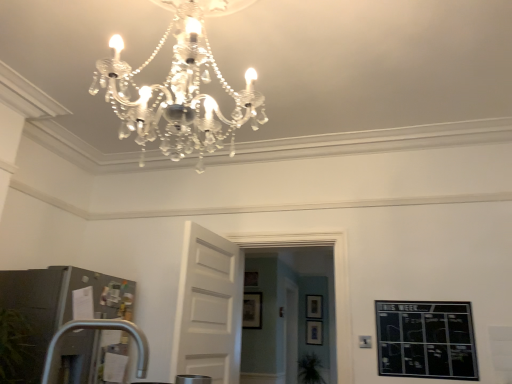
This screenshot has height=384, width=512. Identify the location of wooden picture frame at center, the 1th picture frame viewed from the back. coord(314,306).

This screenshot has height=384, width=512. In order to click on wooden picture frame at center, acting as the first picture frame starting from the left in this screenshot , I will do click(x=251, y=278).

Is wooden picture frame at center, which appears as the third picture frame when viewed from the top, facing away from transparent glass door at center?

No, wooden picture frame at center, which appears as the third picture frame when viewed from the top, is not facing the opposite direction of transparent glass door at center.

Is wooden picture frame at center, which is the fourth picture frame from front to back, spatially inside transparent glass door at center, or outside of it?

wooden picture frame at center, which is the fourth picture frame from front to back, lies outside transparent glass door at center.

Which is more to the left, wooden picture frame at center, placed as the first picture frame when sorted from right to left, or transparent glass door at center?

Positioned to the left is transparent glass door at center.

From a real-world perspective, which is physically below, matte black picture frame at center, the second picture frame from the right, or matte black picture frame at center, which is counted as the 1th picture frame, starting from the front?

matte black picture frame at center, the second picture frame from the right, from a real-world perspective.

Is matte black picture frame at center, the 3th picture frame when ordered from left to right, far from matte black picture frame at center, the second picture frame in the left-to-right sequence?

Yes.

In the scene shown: Which is correct: matte black picture frame at center, placed as the fourth picture frame when sorted from top to bottom, is inside matte black picture frame at center, which is counted as the 1th picture frame, starting from the front, or outside of it?

matte black picture frame at center, placed as the fourth picture frame when sorted from top to bottom, is spatially situated outside matte black picture frame at center, which is counted as the 1th picture frame, starting from the front.

Would you say white wooden door at center is a long distance from wooden picture frame at center, the 1th picture frame viewed from the back?

Yes.

Which of these two, white wooden door at center or wooden picture frame at center, which appears as the third picture frame when viewed from the top, is wider?

Wider between the two is white wooden door at center.

Is white wooden door at center positioned with its back to wooden picture frame at center, the 4th picture frame viewed from the left?

No.

Is transparent glass door at center aimed at wooden picture frame at center, the 1th picture frame viewed from the back?

No, transparent glass door at center is not aimed at wooden picture frame at center, the 1th picture frame viewed from the back.

Can you confirm if transparent glass door at center is bigger than wooden picture frame at center, the 4th picture frame viewed from the left?

Yes, transparent glass door at center is bigger than wooden picture frame at center, the 4th picture frame viewed from the left.

Considering the sizes of objects transparent glass door at center and wooden picture frame at center, positioned as the second picture frame in bottom-to-top order, in the image provided, who is taller, transparent glass door at center or wooden picture frame at center, positioned as the second picture frame in bottom-to-top order,?

transparent glass door at center.

How many degrees apart are the facing directions of matte black picture frame at center, placed as the fourth picture frame when sorted from top to bottom, and green leafy plant at lower center?

They differ by 0.778 degrees in their facing directions.

Can we say matte black picture frame at center, marked as the third picture frame in a front-to-back arrangement, lies outside green leafy plant at lower center?

Yes, matte black picture frame at center, marked as the third picture frame in a front-to-back arrangement, is outside of green leafy plant at lower center.

At what (x,y) coordinates should I click in order to perform the action: click on plant in front of the matte black picture frame at center, the second picture frame from the right. Please return your answer as a coordinate pair (x, y). Looking at the image, I should click on (310, 369).

In the scene shown: Is matte black picture frame at center, the 3th picture frame when ordered from left to right, positioned with its back to green leafy plant at lower center?

No, green leafy plant at lower center is not at the back of matte black picture frame at center, the 3th picture frame when ordered from left to right.

Is white wooden door at center at the right side of matte black picture frame at center, the second picture frame from the right?

No, white wooden door at center is not to the right of matte black picture frame at center, the second picture frame from the right.

Which is in front, white wooden door at center or matte black picture frame at center, the 3th picture frame when ordered from left to right?

white wooden door at center.

Is white wooden door at center oriented towards matte black picture frame at center, the 2th picture frame in the back-to-front sequence?

No.

Is white wooden door at center not inside matte black picture frame at center, the second picture frame from the right?

Absolutely, white wooden door at center is external to matte black picture frame at center, the second picture frame from the right.

Can you confirm if matte black picture frame at center, which ranks as the third picture frame in right-to-left order, is positioned to the right of green leafy plant at lower center?

No.

From the picture: Can you tell me how much matte black picture frame at center, arranged as the 2th picture frame when viewed from the top, and green leafy plant at lower center differ in facing direction?

The facing directions of matte black picture frame at center, arranged as the 2th picture frame when viewed from the top, and green leafy plant at lower center are 0.852 degrees apart.

Between matte black picture frame at center, the second picture frame in the left-to-right sequence, and green leafy plant at lower center, which one is positioned behind?

green leafy plant at lower center is more distant.

Would you say matte black picture frame at center, the second picture frame in the left-to-right sequence, is inside or outside green leafy plant at lower center?

matte black picture frame at center, the second picture frame in the left-to-right sequence, exists outside the volume of green leafy plant at lower center.

You are a GUI agent. You are given a task and a screenshot of the screen. Output one action in this format:
    pyautogui.click(x=<x>, y=<y>)
    Task: Click on the 1st picture frame above the transparent glass door at center (from the image's perspective)
    The image size is (512, 384).
    Given the screenshot: What is the action you would take?
    pyautogui.click(x=314, y=306)

Image resolution: width=512 pixels, height=384 pixels. I want to click on the 2nd picture frame positioned below the matte black picture frame at center, which ranks as the third picture frame in bottom-to-top order (from the image's perspective), so click(314, 332).

Estimate the real-world distances between objects in this image. Which object is closer to matte black picture frame at center, the 3th picture frame when ordered from left to right, white wooden door at center or transparent glass door at center?

transparent glass door at center is closer to matte black picture frame at center, the 3th picture frame when ordered from left to right.

Looking at the image, which one is located further to transparent glass door at center, wooden picture frame at center, the second picture frame positioned from the front, or matte black picture frame at center, the 3th picture frame when ordered from left to right?

Among the two, matte black picture frame at center, the 3th picture frame when ordered from left to right, is located further to transparent glass door at center.

From the image, which object appears to be farther from white wooden door at center, matte black picture frame at center, the 3th picture frame when ordered from left to right, or wooden picture frame at center, placed as the first picture frame when sorted from right to left?

Among the two, wooden picture frame at center, placed as the first picture frame when sorted from right to left, is located further to white wooden door at center.

Based on their spatial positions, is white wooden door at center or transparent glass door at center closer to wooden picture frame at center, the fourth picture frame from the right?

transparent glass door at center is positioned closer to the anchor wooden picture frame at center, the fourth picture frame from the right.

Looking at the image, which one is located closer to green leafy plant at lower center, wooden picture frame at center, the 1th picture frame viewed from the back, or wooden picture frame at center, the fourth picture frame from the right?

wooden picture frame at center, the 1th picture frame viewed from the back, is positioned closer to the anchor green leafy plant at lower center.

When comparing their distances from transparent glass door at center, does white wooden door at center or wooden picture frame at center, acting as the first picture frame starting from the left, seem closer?

Based on the image, wooden picture frame at center, acting as the first picture frame starting from the left, appears to be nearer to transparent glass door at center.

Considering their positions, is wooden picture frame at center, positioned as the second picture frame in bottom-to-top order, positioned closer to wooden picture frame at center, which appears as the 3th picture frame when viewed from the back, than matte black picture frame at center, the second picture frame in the left-to-right sequence?

matte black picture frame at center, the second picture frame in the left-to-right sequence, is closer to wooden picture frame at center, which appears as the 3th picture frame when viewed from the back.

When comparing their distances from wooden picture frame at center, placed as the first picture frame when sorted from right to left, does green leafy plant at lower center or transparent glass door at center seem closer?

green leafy plant at lower center lies closer to wooden picture frame at center, placed as the first picture frame when sorted from right to left, than the other object.

Locate an element on the screen. picture frame positioned between white wooden door at center and wooden picture frame at center, the fourth picture frame from the right, from near to far is located at coordinates (252, 310).

Identify the location of picture frame positioned between matte black picture frame at center, which ranks as the third picture frame in bottom-to-top order, and matte black picture frame at center, placed as the fourth picture frame when sorted from top to bottom, from near to far. (251, 278).

At what (x,y) coordinates should I click in order to perform the action: click on glass door positioned between matte black picture frame at center, which is counted as the 1th picture frame, starting from the front, and matte black picture frame at center, marked as the third picture frame in a front-to-back arrangement, from near to far. Please return your answer as a coordinate pair (x, y). The image size is (512, 384). Looking at the image, I should click on (287, 330).

The width and height of the screenshot is (512, 384). I want to click on plant between transparent glass door at center and wooden picture frame at center, which is the fourth picture frame from front to back, in the front-back direction, so click(310, 369).